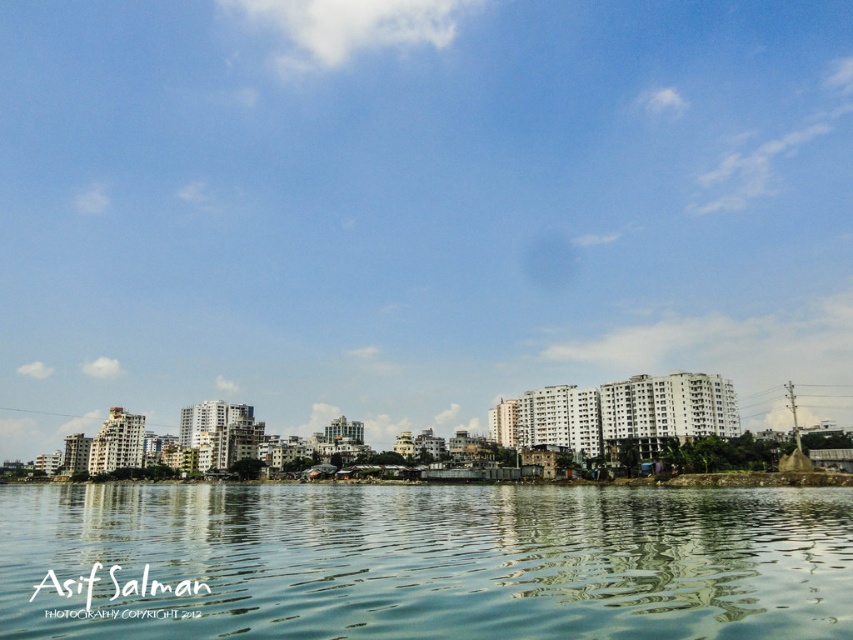
Who is more forward, [776,232] or [450,500]?

Positioned in front is point [450,500].

Is blue sky at upper center thinner than clear water at center?

Incorrect, blue sky at upper center's width is not less than clear water at center's.

This screenshot has width=853, height=640. In order to click on blue sky at upper center in this screenshot , I will do `click(416, 205)`.